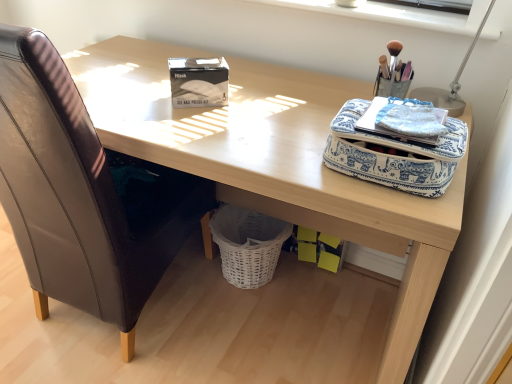
Question: Can you confirm if brown leather chair at left is thinner than metallic silver table lamp at upper right?

Choices:
 (A) no
 (B) yes

Answer: (A)

Question: Is brown leather chair at left to the right of metallic silver table lamp at upper right from the viewer's perspective?

Choices:
 (A) no
 (B) yes

Answer: (A)

Question: Can you confirm if brown leather chair at left is bigger than metallic silver table lamp at upper right?

Choices:
 (A) no
 (B) yes

Answer: (B)

Question: Does brown leather chair at left turn towards metallic silver table lamp at upper right?

Choices:
 (A) no
 (B) yes

Answer: (A)

Question: From a real-world perspective, is brown leather chair at left under metallic silver table lamp at upper right?

Choices:
 (A) no
 (B) yes

Answer: (B)

Question: Is metallic silver table lamp at upper right located within brown leather chair at left?

Choices:
 (A) no
 (B) yes

Answer: (A)

Question: Does blue printed fabric bag at upper right have a greater height compared to white plastic at upper center?

Choices:
 (A) yes
 (B) no

Answer: (A)

Question: From a real-world perspective, is blue printed fabric bag at upper right on white plastic at upper center?

Choices:
 (A) no
 (B) yes

Answer: (A)

Question: Considering the relative positions of blue printed fabric bag at upper right and white plastic at upper center in the image provided, is blue printed fabric bag at upper right behind white plastic at upper center?

Choices:
 (A) yes
 (B) no

Answer: (B)

Question: Considering the relative positions of blue printed fabric bag at upper right and white plastic at upper center in the image provided, is blue printed fabric bag at upper right in front of white plastic at upper center?

Choices:
 (A) no
 (B) yes

Answer: (B)

Question: Is blue printed fabric bag at upper right thinner than white plastic at upper center?

Choices:
 (A) no
 (B) yes

Answer: (A)

Question: Is blue printed fabric bag at upper right located outside white plastic at upper center?

Choices:
 (A) no
 (B) yes

Answer: (B)

Question: Considering the relative positions of metallic silver table lamp at upper right and blue printed fabric bag at upper right in the image provided, is metallic silver table lamp at upper right to the left of blue printed fabric bag at upper right from the viewer's perspective?

Choices:
 (A) yes
 (B) no

Answer: (B)